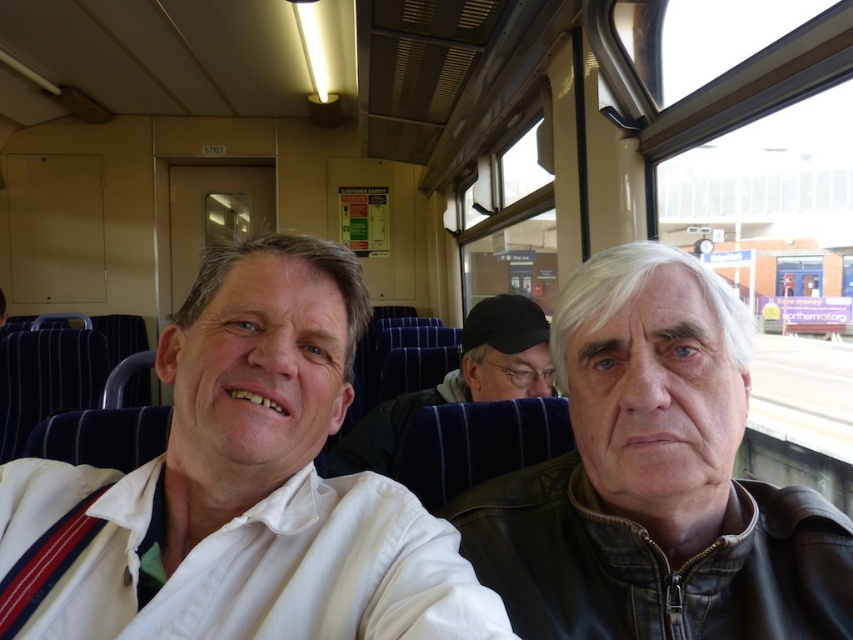
You are standing at the point marked as point [306,508] in the train carriage. You need to take a photo of the entire train carriage. If your camera has a maximum focus range of 22 inches, will it be able to capture the entire scene clearly?

The distance between point [306,508] and the camera is 22.16 inches. Since the camera can only focus up to 22 inches, it will not be able to capture the entire scene clearly as the distance exceeds the maximum focus range.

You are standing in the train carriage and want to touch the point at coordinates (654, 480). Which object in the scene would you be touching if you reach out to that point?

The point at coordinates (654, 480) is located on the leather jacket at right, so touching that point would mean you are touching the leather jacket at right.

You are a passenger on the train and want to hand a brochure to the person wearing the white shirt at center without disturbing the person in the leather jacket at right. Can you do this directly from your current position?

The white shirt at center is closer to the viewer than the leather jacket at right, so you can hand the brochure directly to the person wearing the white shirt at center without needing to move around the leather jacket at right.